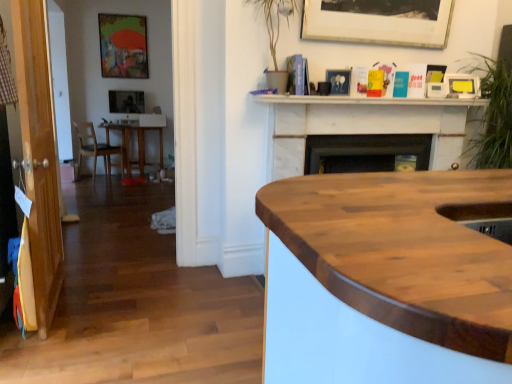
Question: Looking at their shapes, would you say wooden table at left is wider or thinner than yellow matte picture frame at upper right, the 1th picture frame from the right?

Choices:
 (A) wide
 (B) thin

Answer: (A)

Question: Relative to yellow matte picture frame at upper right, which appears as the 2th picture frame when ordered from the bottom, is wooden table at left in front or behind?

Choices:
 (A) behind
 (B) front

Answer: (A)

Question: Which object is the closest to the transparent wood door at left?

Choices:
 (A) wooden table at left
 (B) matte black picture frame at upper left, marked as the second picture frame in a left-to-right arrangement
 (C) white marble fireplace at upper center
 (D) wooden chair at left
 (E) green leafy plant at upper right

Answer: (C)

Question: Which object is the closest to the transparent wood door at left?

Choices:
 (A) matte wooden picture frame at upper left, placed as the fourth picture frame when sorted from right to left
 (B) black matte fireplace at center
 (C) white marble fireplace at upper center
 (D) matte black picture frame at upper left, the first picture frame in the back-to-front sequence
 (E) wooden at center

Answer: (C)